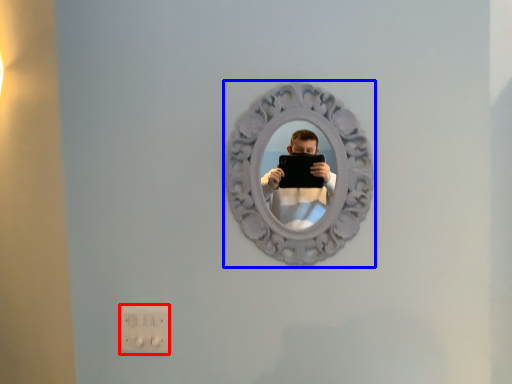
Question: Which of the following is the closest to the observer, electric outlet (highlighted by a red box) or view mirror (highlighted by a blue box)?

Choices:
 (A) electric outlet
 (B) view mirror

Answer: (B)